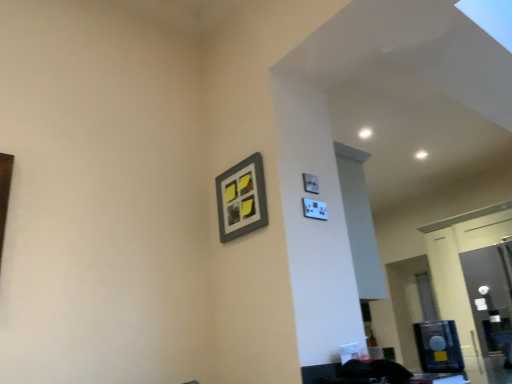
The height and width of the screenshot is (384, 512). Describe the element at coordinates (490, 294) in the screenshot. I see `transparent glass door at right` at that location.

This screenshot has height=384, width=512. I want to click on transparent glass door at right, so click(x=490, y=294).

The image size is (512, 384). Describe the element at coordinates (241, 199) in the screenshot. I see `matte gray picture frame at upper right` at that location.

What are the coordinates of `matte gray picture frame at upper right` in the screenshot? It's located at (241, 199).

At what (x,y) coordinates should I click in order to perform the action: click on transparent glass door at right. Please return your answer as a coordinate pair (x, y). This screenshot has width=512, height=384. Looking at the image, I should click on (490, 294).

In the scene shown: Can you confirm if matte gray picture frame at upper right is positioned to the right of transparent glass door at right?

Incorrect, matte gray picture frame at upper right is not on the right side of transparent glass door at right.

Does matte gray picture frame at upper right lie behind transparent glass door at right?

No, the depth of matte gray picture frame at upper right is less than that of transparent glass door at right.

Is point (228, 240) closer to viewer compared to point (475, 284)?

Yes.

From the image's perspective, is matte gray picture frame at upper right over transparent glass door at right?

Correct, matte gray picture frame at upper right appears higher than transparent glass door at right in the image.

In the scene shown: From a real-world perspective, is matte gray picture frame at upper right beneath transparent glass door at right?

No, from a real-world perspective, matte gray picture frame at upper right is not under transparent glass door at right.

Considering the sizes of objects matte gray picture frame at upper right and transparent glass door at right in the image provided, who is wider, matte gray picture frame at upper right or transparent glass door at right?

With larger width is transparent glass door at right.

Which of these two, matte gray picture frame at upper right or transparent glass door at right, stands taller?

Standing taller between the two is transparent glass door at right.

Is matte gray picture frame at upper right bigger than transparent glass door at right?

Actually, matte gray picture frame at upper right might be smaller than transparent glass door at right.

Is matte gray picture frame at upper right outside of transparent glass door at right?

Yes, matte gray picture frame at upper right is not within transparent glass door at right.

Is matte gray picture frame at upper right directly adjacent to transparent glass door at right?

matte gray picture frame at upper right is not next to transparent glass door at right, and they're not touching.

Based on the photo, is matte gray picture frame at upper right turned away from transparent glass door at right?

Yes, transparent glass door at right is at the back of matte gray picture frame at upper right.

How different are the orientations of matte gray picture frame at upper right and transparent glass door at right in degrees?

There is a 0.0255-degree angle between the facing directions of matte gray picture frame at upper right and transparent glass door at right.

Locate an element on the screen. The image size is (512, 384). picture frame on the left of transparent glass door at right is located at coordinates (241, 199).

Which is more to the left, transparent glass door at right or matte gray picture frame at upper right?

matte gray picture frame at upper right.

From the picture: Which is in front, transparent glass door at right or matte gray picture frame at upper right?

matte gray picture frame at upper right is in front.

Between point (504, 298) and point (218, 220), which one is positioned behind?

Point (504, 298)

From the image's perspective, does transparent glass door at right appear lower than matte gray picture frame at upper right?

Yes.

From a real-world perspective, does transparent glass door at right stand above matte gray picture frame at upper right?

Incorrect, from a real-world perspective, transparent glass door at right is lower than matte gray picture frame at upper right.

Which object is thinner, transparent glass door at right or matte gray picture frame at upper right?

matte gray picture frame at upper right is thinner.

Is transparent glass door at right shorter than matte gray picture frame at upper right?

Incorrect, the height of transparent glass door at right does not fall short of that of matte gray picture frame at upper right.

Can you confirm if transparent glass door at right is smaller than matte gray picture frame at upper right?

Incorrect, transparent glass door at right is not smaller in size than matte gray picture frame at upper right.

Is matte gray picture frame at upper right completely or partially inside transparent glass door at right?

Definitely not — matte gray picture frame at upper right is not inside transparent glass door at right.

Is transparent glass door at right directly adjacent to matte gray picture frame at upper right?

They are not placed beside each other.

Is transparent glass door at right positioned with its back to matte gray picture frame at upper right?

No, transparent glass door at right is not facing away from matte gray picture frame at upper right.

Where is `picture frame located on the left of transparent glass door at right`? This screenshot has height=384, width=512. picture frame located on the left of transparent glass door at right is located at coordinates (241, 199).

Where is `picture frame in front of the transparent glass door at right`? picture frame in front of the transparent glass door at right is located at coordinates (241, 199).

At what (x,y) coordinates should I click in order to perform the action: click on glass door lying behind the matte gray picture frame at upper right. Please return your answer as a coordinate pair (x, y). The image size is (512, 384). Looking at the image, I should click on (490, 294).